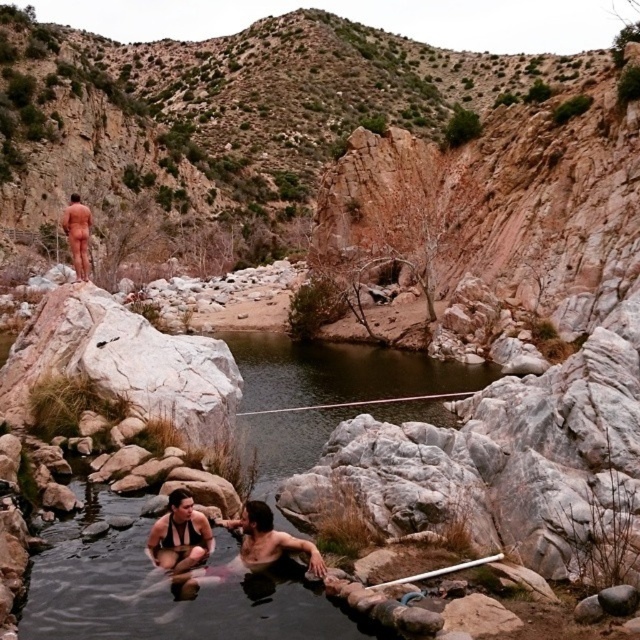
Question: Does matte black swimsuit at center appear on the left side of nude skin at upper left?

Choices:
 (A) no
 (B) yes

Answer: (A)

Question: Can you confirm if matte black swimsuit at center is smaller than nude skin at upper left?

Choices:
 (A) no
 (B) yes

Answer: (B)

Question: Which of the following is the closest to the observer?

Choices:
 (A) matte black swimsuit at center
 (B) nude skin at upper left

Answer: (A)

Question: Which point is farther to the camera?

Choices:
 (A) (269, 524)
 (B) (88, 216)

Answer: (B)

Question: In this image, where is matte black swimsuit at center located relative to nude skin at upper left?

Choices:
 (A) left
 (B) right

Answer: (B)